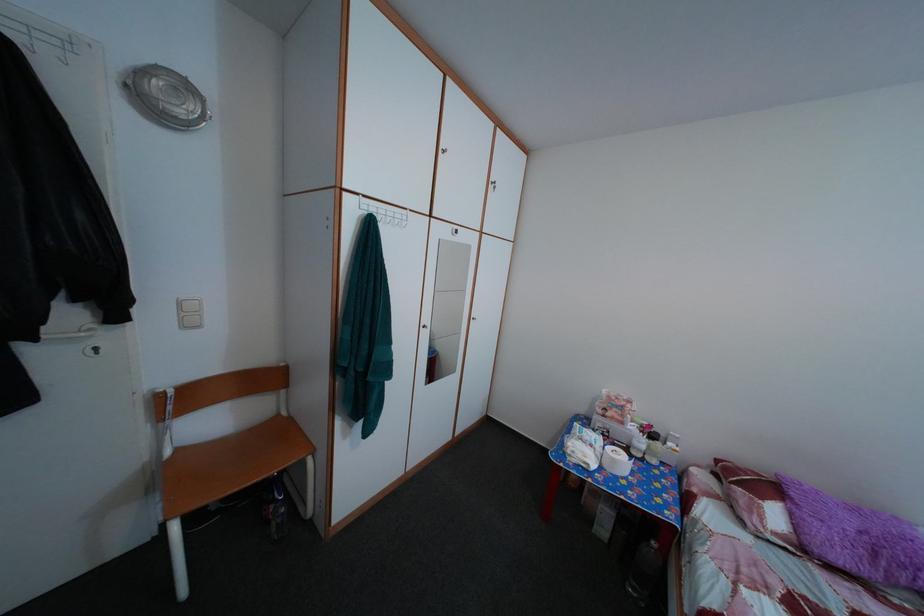
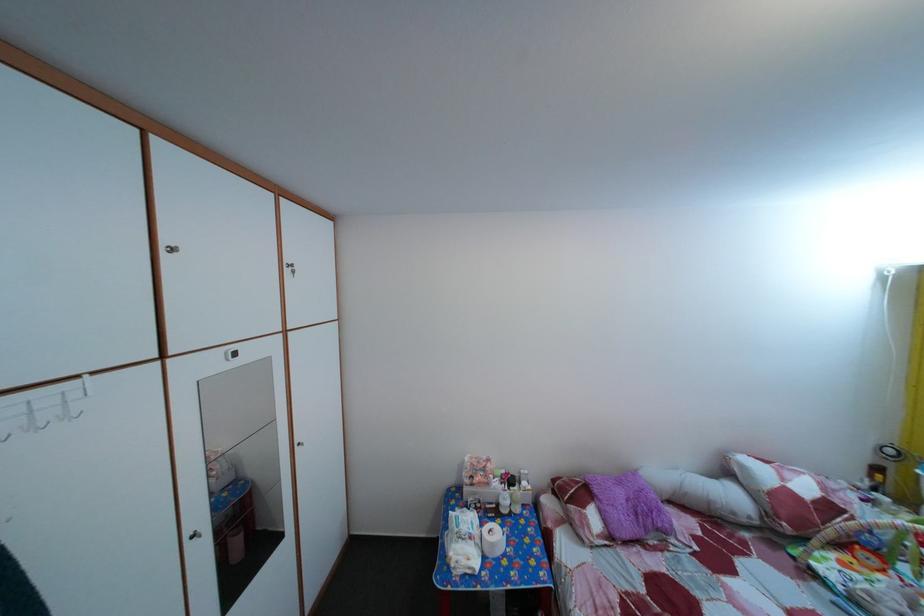
The point at (667, 442) is marked in the first image. Where is the corresponding point in the second image?

(524, 485)